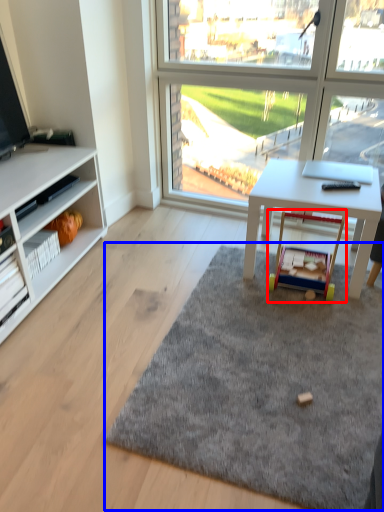
Question: Which object is closer to the camera taking this photo, toy (highlighted by a red box) or mat (highlighted by a blue box)?

Choices:
 (A) toy
 (B) mat

Answer: (B)